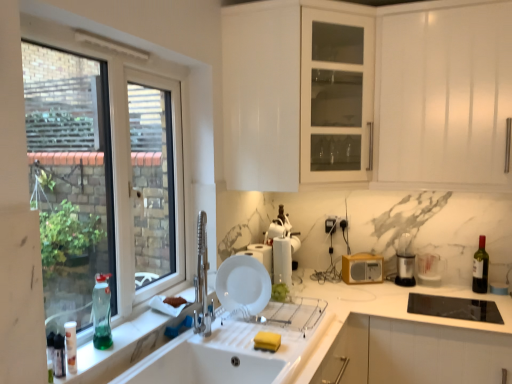
Identify the location of vacant area on the back side of white plastic bottle at lower left, the 1th bottle from the left. This screenshot has height=384, width=512. (96, 350).